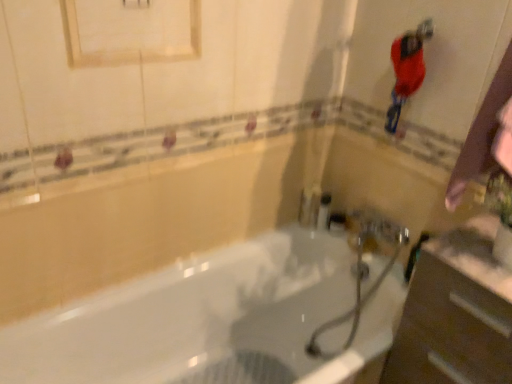
Question: Based on their positions, is white matte medicine cabinet at upper center located to the left or right of shiny red hairbrush at upper right?

Choices:
 (A) left
 (B) right

Answer: (A)

Question: Is white matte medicine cabinet at upper center inside or outside of shiny red hairbrush at upper right?

Choices:
 (A) inside
 (B) outside

Answer: (B)

Question: Estimate the real-world distances between objects in this image. Which object is farther from the shiny red hairbrush at upper right?

Choices:
 (A) metallic silver faucet at center
 (B) white matte medicine cabinet at upper center
 (C) white glossy bathtub at center

Answer: (C)

Question: Estimate the real-world distances between objects in this image. Which object is farther from the white glossy bathtub at center?

Choices:
 (A) metallic silver faucet at center
 (B) white matte medicine cabinet at upper center
 (C) shiny red hairbrush at upper right

Answer: (B)